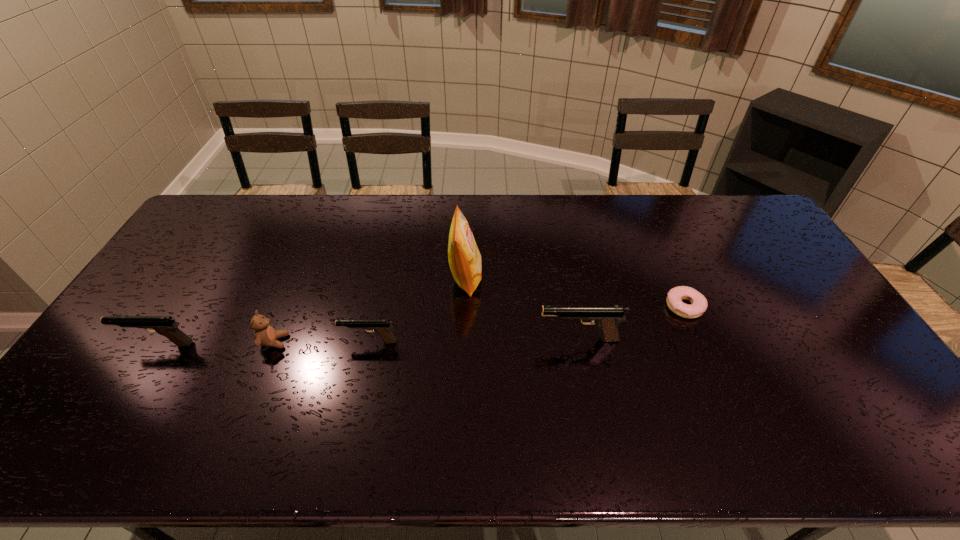
Locate an element on the screen. The width and height of the screenshot is (960, 540). doughnut is located at coordinates (698, 306).

This screenshot has width=960, height=540. Identify the location of vacant point located at the muzzle of the second tallest pistol. (107, 345).

The image size is (960, 540). What are the coordinates of `blank space located 0.060m at the muzzle of the fifth tallest object` in the screenshot? It's located at (321, 342).

Locate an element on the screen. The height and width of the screenshot is (540, 960). vacant space located 0.290m at the muzzle of the fifth tallest object is located at coordinates (238, 342).

Locate an element on the screen. vacant space located at the muzzle of the fifth tallest object is located at coordinates (209, 342).

Where is `free point located at the muzzle of the tallest pistol`? free point located at the muzzle of the tallest pistol is located at coordinates (473, 339).

Locate an element on the screen. blank space located 0.280m at the muzzle of the tallest pistol is located at coordinates (438, 339).

The width and height of the screenshot is (960, 540). In order to click on free location located 0.170m at the muzzle of the tallest pistol in this screenshot , I will do `click(477, 339)`.

At what (x,y) coordinates should I click in order to perform the action: click on vacant region located on the front-facing side of the fourth object from left to right. Please return your answer as a coordinate pair (x, y). The image size is (960, 540). Looking at the image, I should click on (541, 278).

The image size is (960, 540). I want to click on free point located 0.120m on the front-facing side of the fifth object from right to left, so click(330, 341).